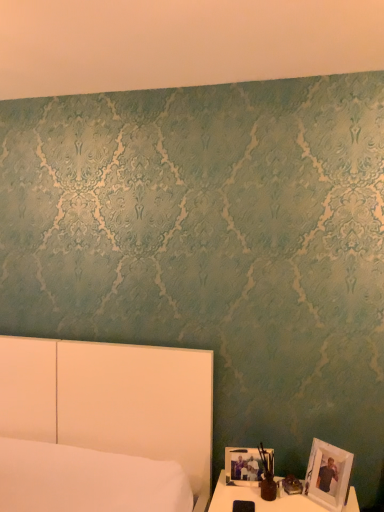
Question: From their relative heights in the image, would you say matte brown vase at lower right is taller or shorter than white glossy table at lower right?

Choices:
 (A) short
 (B) tall

Answer: (B)

Question: Visually, is matte brown vase at lower right positioned to the left or to the right of white glossy table at lower right?

Choices:
 (A) left
 (B) right

Answer: (A)

Question: Which object is positioned farthest from the white matte picture frame at lower right, the second picture frame viewed from the right?

Choices:
 (A) white wooden picture frame at lower right, positioned as the second picture frame in left-to-right order
 (B) white glossy table at lower right
 (C) matte brown vase at lower right

Answer: (A)

Question: Which object is positioned closest to the white wooden picture frame at lower right, positioned as the second picture frame in left-to-right order?

Choices:
 (A) white glossy table at lower right
 (B) white matte picture frame at lower right, the second picture frame viewed from the right
 (C) matte brown vase at lower right

Answer: (A)